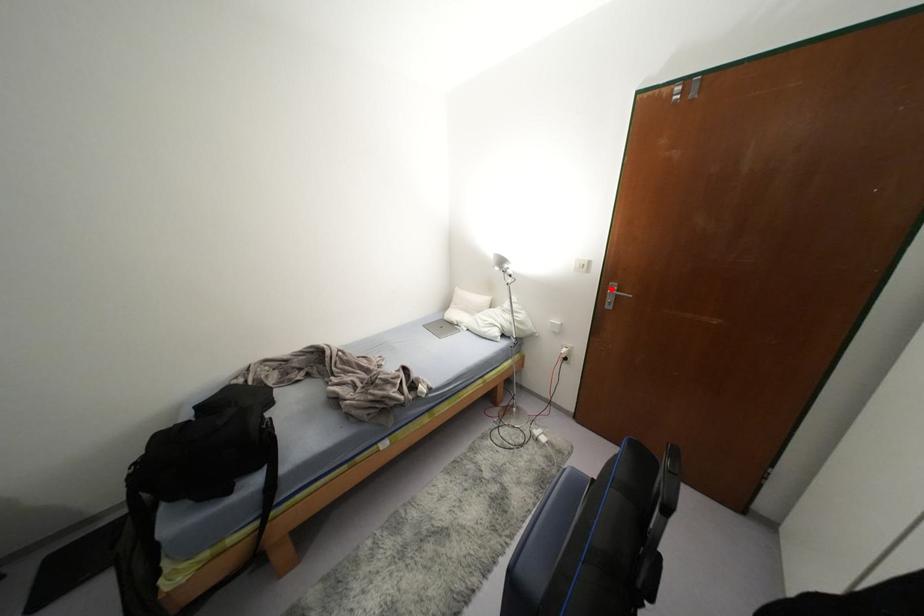
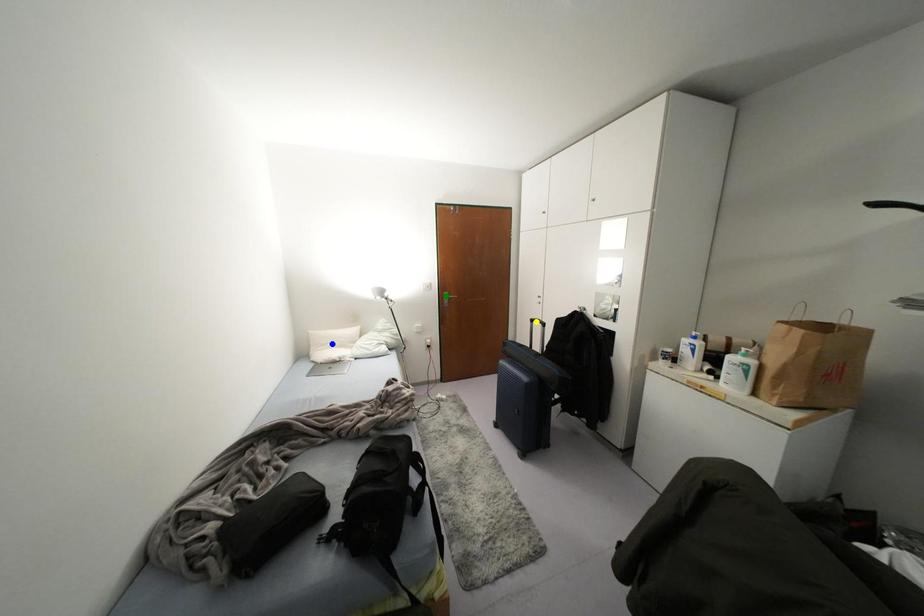
Question: I am providing you with two images of the same scene from different viewpoints. A red point is marked on the first image. You are given multiple points on the second image. Which mark in image 2 goes with the point in image 1?

Choices:
 (A) yellow point
 (B) blue point
 (C) green point

Answer: (C)